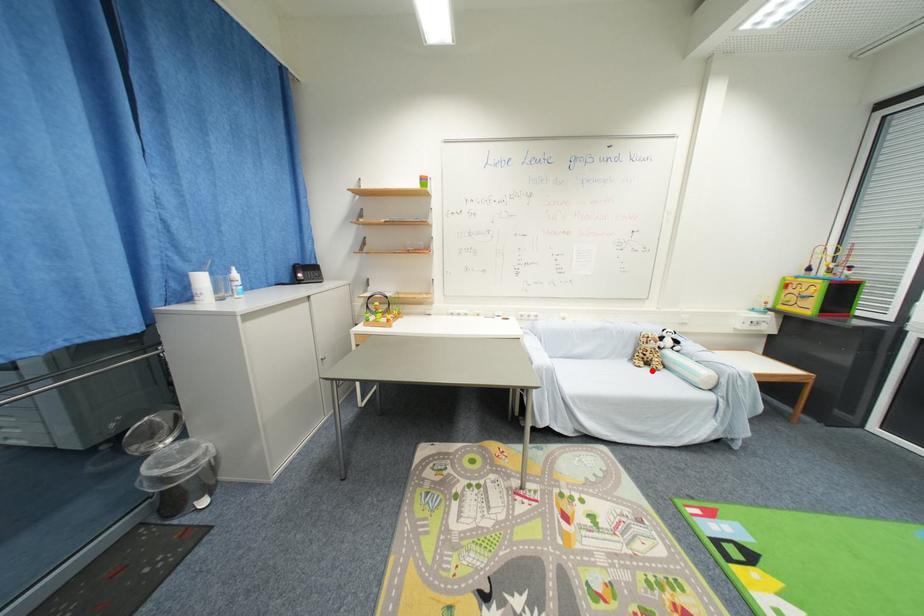
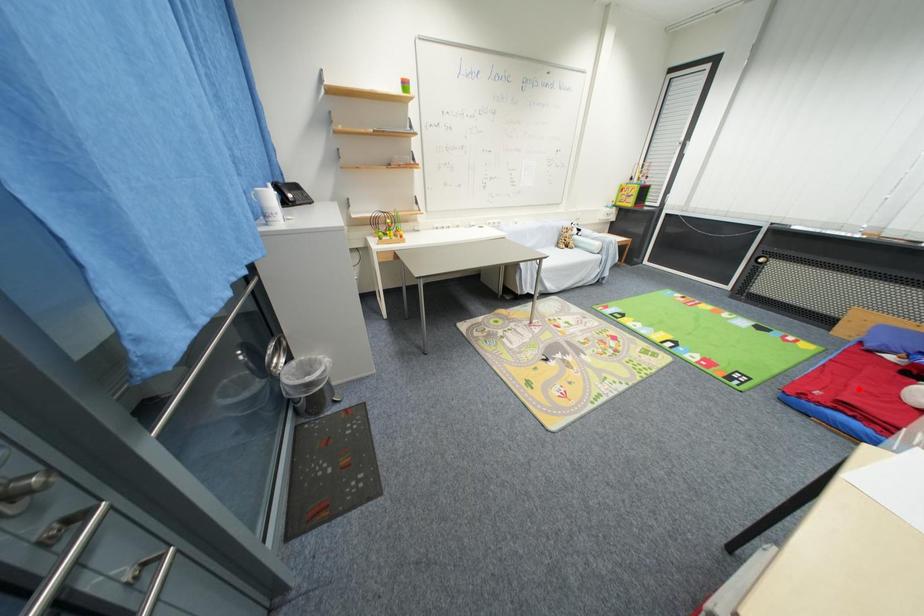
I am providing you with two images of the same scene from different viewpoints. A red point is marked on the first image and another point is marked on the second image. Do the highlighted points in image1 and image2 indicate the same real-world spot?

No